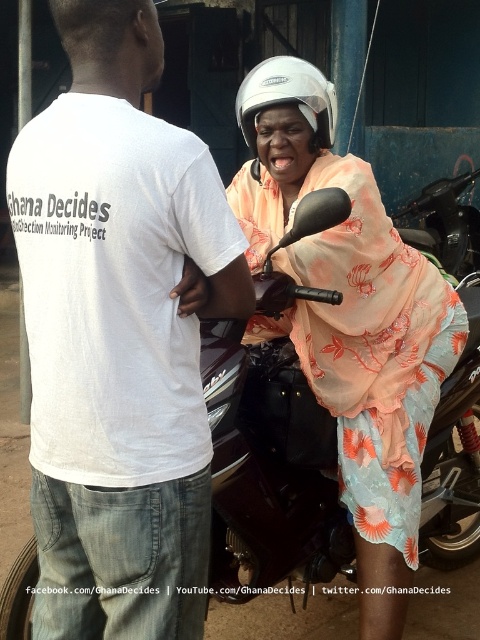
Question: Among these objects, which one is farthest from the camera?

Choices:
 (A) floral fabric helmet at upper center
 (B) shiny dark brown motorcycle at center
 (C) white matte helmet at upper center

Answer: (C)

Question: Is floral fabric helmet at upper center positioned before shiny dark brown motorcycle at center?

Choices:
 (A) no
 (B) yes

Answer: (A)

Question: Based on their relative distances, which object is farther from the white matte helmet at upper center?

Choices:
 (A) white cotton shirt at center
 (B) shiny dark brown motorcycle at center

Answer: (A)

Question: Does white cotton shirt at center appear over floral fabric helmet at upper center?

Choices:
 (A) no
 (B) yes

Answer: (A)

Question: Which of these objects is positioned farthest from the shiny dark brown motorcycle at center?

Choices:
 (A) floral fabric helmet at upper center
 (B) white cotton shirt at center
 (C) white matte helmet at upper center

Answer: (C)

Question: Observing the image, what is the correct spatial positioning of shiny dark brown motorcycle at center in reference to white matte helmet at upper center?

Choices:
 (A) left
 (B) right

Answer: (A)